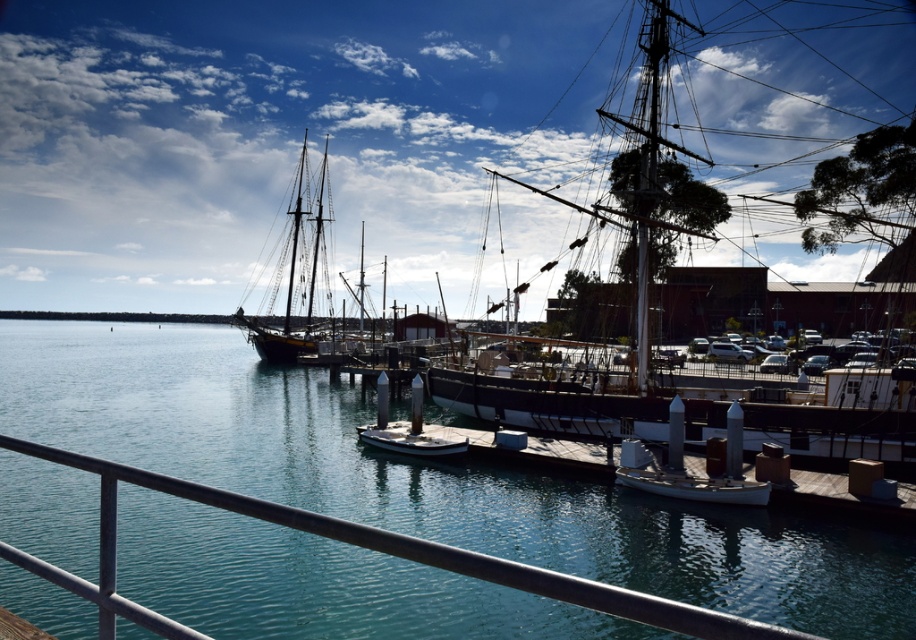
Between metallic gray rail at lower center and dark wood sailboat at center, which one is positioned lower?

metallic gray rail at lower center is below.

Is point (104, 468) behind point (311, 266)?

No, (104, 468) is closer to viewer.

Which is in front, point (711, 634) or point (268, 308)?

Point (711, 634) is in front.

Locate an element on the screen. This screenshot has height=640, width=916. metallic gray rail at lower center is located at coordinates (365, 547).

What do you see at coordinates (365, 547) in the screenshot?
I see `metallic gray rail at lower center` at bounding box center [365, 547].

Is point (645, 604) positioned before point (671, 403)?

Yes, it is in front of point (671, 403).

Who is more forward, (64, 461) or (675, 408)?

Point (64, 461) is more forward.

The image size is (916, 640). Find the location of `metallic gray rail at lower center`. metallic gray rail at lower center is located at coordinates (365, 547).

Who is positioned more to the right, white wooden ship at center or dark wood sailboat at center?

white wooden ship at center is more to the right.

Can you confirm if white wooden ship at center is thinner than dark wood sailboat at center?

No.

Between point (623, 150) and point (300, 288), which one is positioned in front?

Point (623, 150) is more forward.

Where is `white wooden ship at center`? white wooden ship at center is located at coordinates (759, 156).